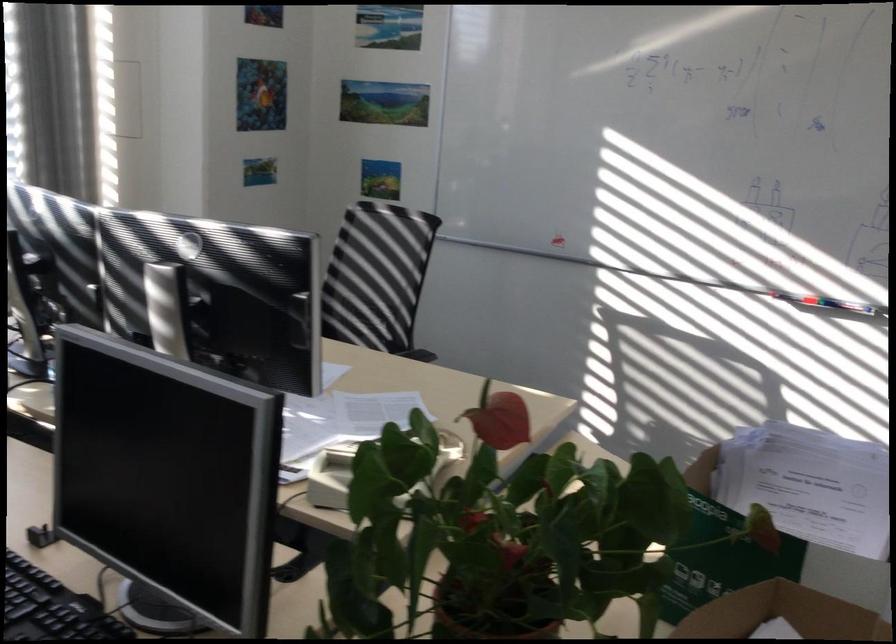
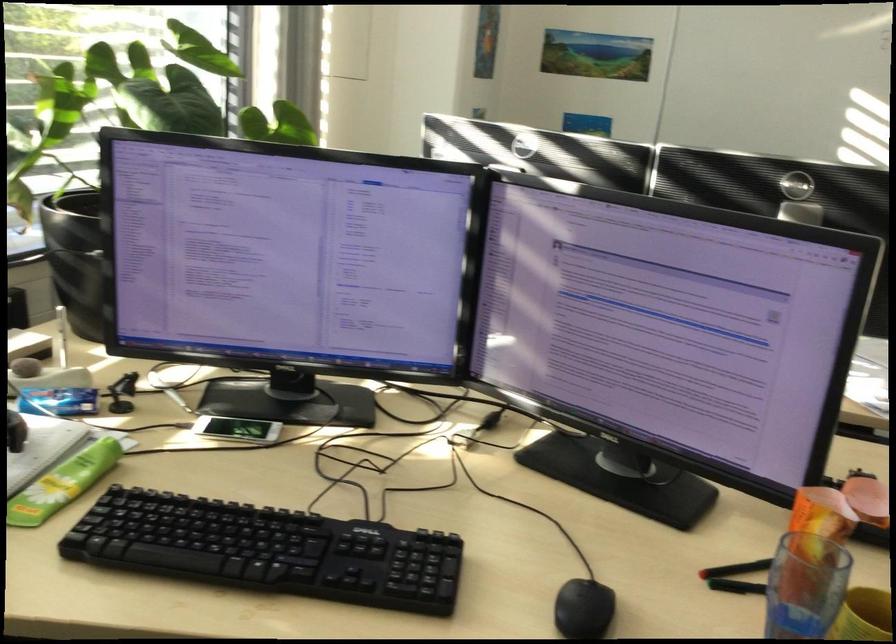
Question: The images are taken continuously from a first-person perspective. In which direction are you moving?

Choices:
 (A) Left
 (B) Right
 (C) Forward
 (D) Backward

Answer: (A)